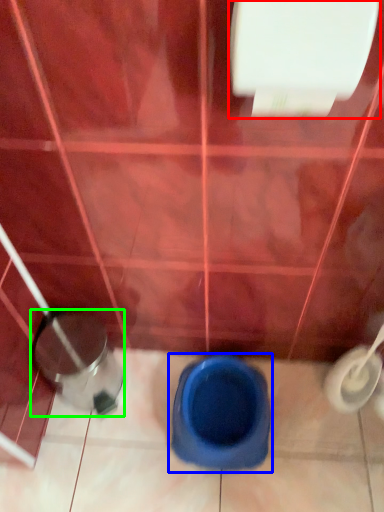
Question: Which object is positioned closest to toilet paper (highlighted by a red box)? Select from toilet (highlighted by a blue box) and potty (highlighted by a green box).

Choices:
 (A) toilet
 (B) potty

Answer: (B)